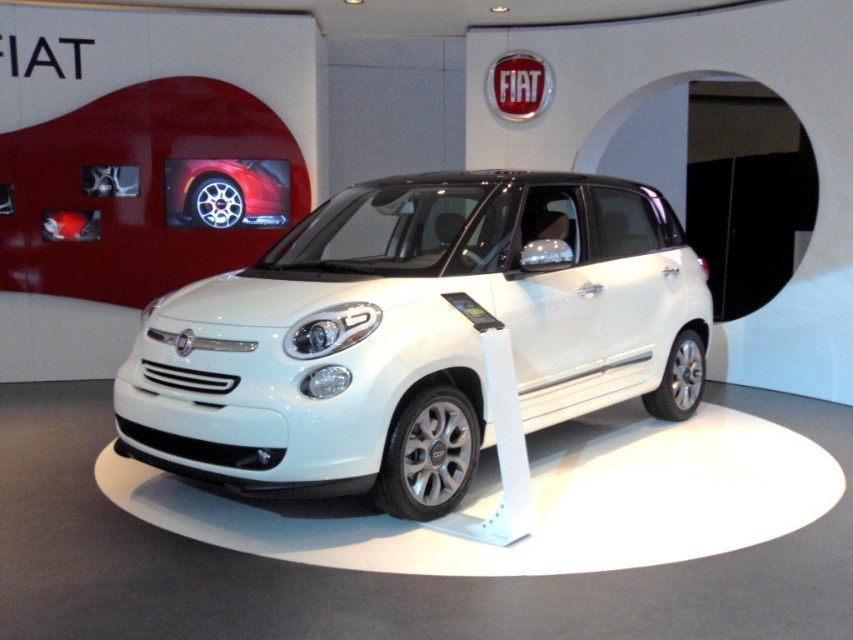
Is white metallic car at center bigger than shiny silver rim at center?

Correct, white metallic car at center is larger in size than shiny silver rim at center.

Does white metallic car at center have a smaller size compared to shiny silver rim at center?

No, white metallic car at center is not smaller than shiny silver rim at center.

Between point (254, 397) and point (270, 216), which one is positioned in front?

Point (254, 397)

Find the location of a particular element. white metallic car at center is located at coordinates (416, 336).